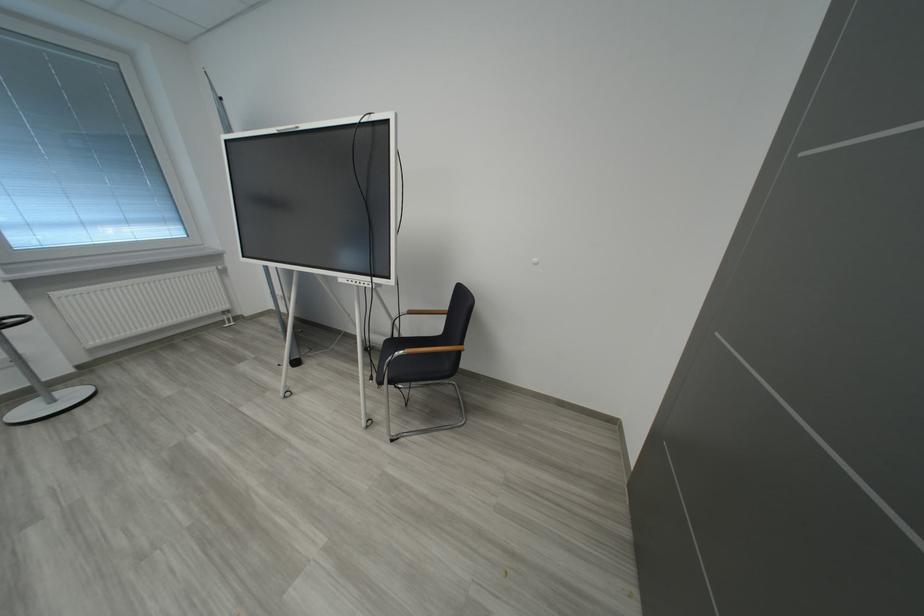
You are a GUI agent. You are given a task and a screenshot of the screen. Output one action in this format:
    pyautogui.click(x=<x>, y=<y>)
    Task: Click on the black chair sitting surface
    The image size is (924, 616).
    Given the screenshot: What is the action you would take?
    pyautogui.click(x=406, y=345)